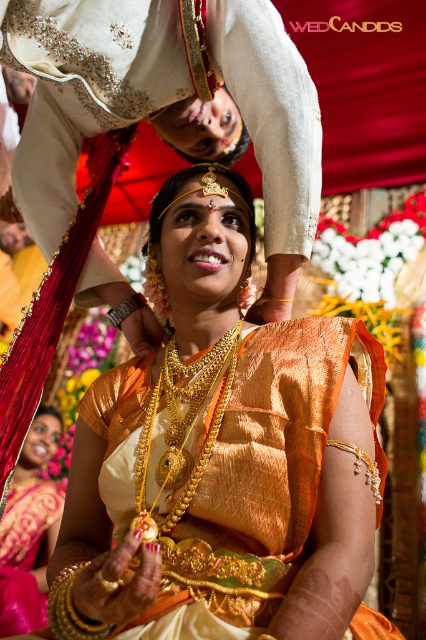
Between point (299, 456) and point (40, 508), which one is positioned in front?

Point (299, 456) is in front.

The width and height of the screenshot is (426, 640). Describe the element at coordinates (221, 458) in the screenshot. I see `shiny gold necklace at center` at that location.

Between point (215, 298) and point (11, 600), which one is positioned behind?

Positioned behind is point (11, 600).

Find the location of a particular element. shiny gold necklace at center is located at coordinates (221, 458).

Which is in front, point (339, 372) or point (43, 147)?

Positioned in front is point (339, 372).

Between point (132, 616) and point (29, 28), which one is positioned behind?

The point (29, 28) is behind.

Where is `shiny gold necklace at center`? This screenshot has height=640, width=426. shiny gold necklace at center is located at coordinates (221, 458).

Does golden ornate necklace at center appear on the right side of matte gold necklace at center?

Indeed, golden ornate necklace at center is positioned on the right side of matte gold necklace at center.

Between golden ornate necklace at center and matte gold necklace at center, which one is positioned lower?

matte gold necklace at center is lower down.

Which is in front, point (244, 116) or point (34, 518)?

Point (244, 116)

I want to click on golden ornate necklace at center, so click(x=83, y=88).